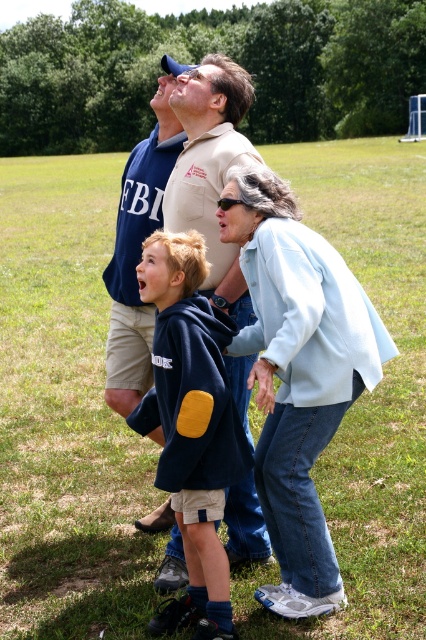
In the scene described, where is the light blue denim jacket at center located in terms of coordinates?

The light blue denim jacket at center is located at coordinates point (x=298, y=374).